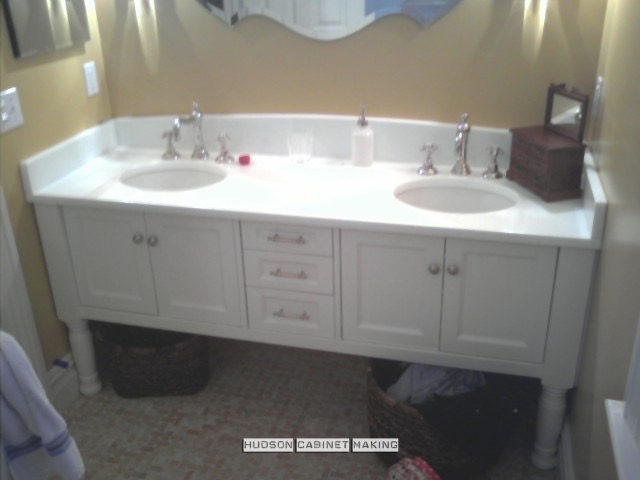
Where is `soap dispenser`? The height and width of the screenshot is (480, 640). soap dispenser is located at coordinates (365, 140).